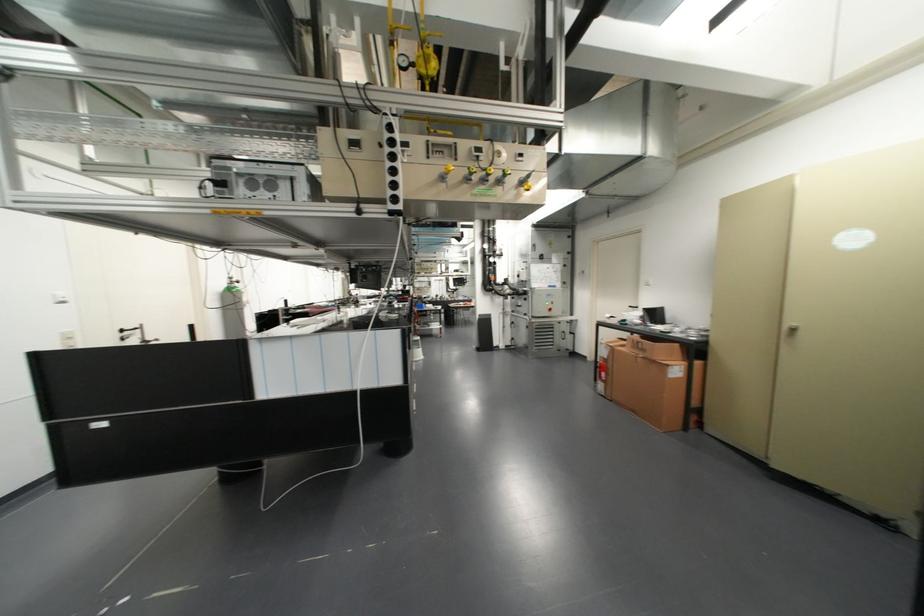
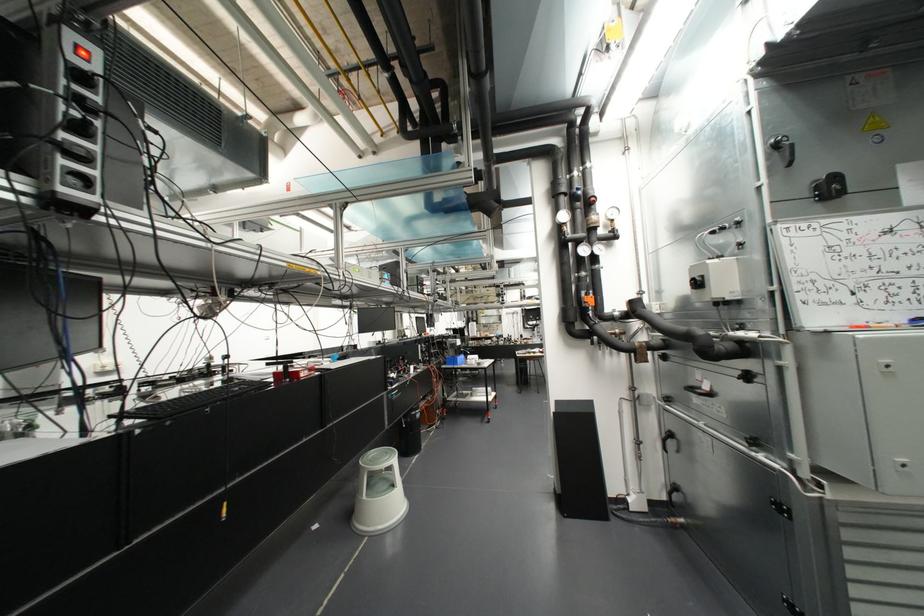
Question: The images are taken continuously from a first-person perspective. In which direction are you moving?

Choices:
 (A) Left
 (B) Right
 (C) Forward
 (D) Backward

Answer: (C)